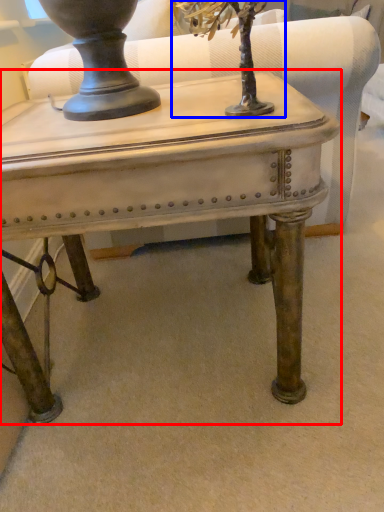
Question: Among these objects, which one is farthest to the camera, table (highlighted by a red box) or tree (highlighted by a blue box)?

Choices:
 (A) table
 (B) tree

Answer: (A)